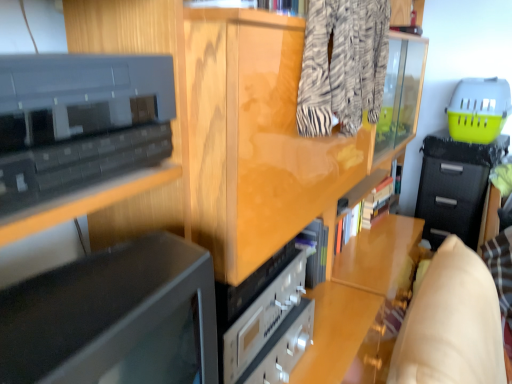
Question: Should I look upward or downward to see zebra-patterned fabric at upper center?

Choices:
 (A) up
 (B) down

Answer: (A)

Question: Can you confirm if zebra-patterned fabric at upper center is taller than black fabric drawer at right?

Choices:
 (A) no
 (B) yes

Answer: (A)

Question: Is black fabric drawer at right at the back of zebra-patterned fabric at upper center?

Choices:
 (A) yes
 (B) no

Answer: (B)

Question: Is zebra-patterned fabric at upper center oriented towards black fabric drawer at right?

Choices:
 (A) yes
 (B) no

Answer: (B)

Question: Can you confirm if zebra-patterned fabric at upper center is wider than black fabric drawer at right?

Choices:
 (A) yes
 (B) no

Answer: (B)

Question: Is zebra-patterned fabric at upper center positioned before black fabric drawer at right?

Choices:
 (A) yes
 (B) no

Answer: (A)

Question: Is zebra-patterned fabric at upper center next to black fabric drawer at right and touching it?

Choices:
 (A) no
 (B) yes

Answer: (A)

Question: Is black fabric drawer at right positioned in front of black glossy cabinet at upper left?

Choices:
 (A) yes
 (B) no

Answer: (B)

Question: Is black glossy cabinet at upper left located within black fabric drawer at right?

Choices:
 (A) yes
 (B) no

Answer: (B)

Question: Is black fabric drawer at right positioned behind black glossy cabinet at upper left?

Choices:
 (A) no
 (B) yes

Answer: (B)

Question: Does black fabric drawer at right have a lesser width compared to black glossy cabinet at upper left?

Choices:
 (A) yes
 (B) no

Answer: (B)

Question: Does black fabric drawer at right touch black glossy cabinet at upper left?

Choices:
 (A) no
 (B) yes

Answer: (A)

Question: Is black fabric drawer at right wider than black glossy cabinet at upper left?

Choices:
 (A) no
 (B) yes

Answer: (B)

Question: Can you confirm if black glossy cabinet at upper left is positioned to the right of zebra-patterned fabric at upper center?

Choices:
 (A) yes
 (B) no

Answer: (B)